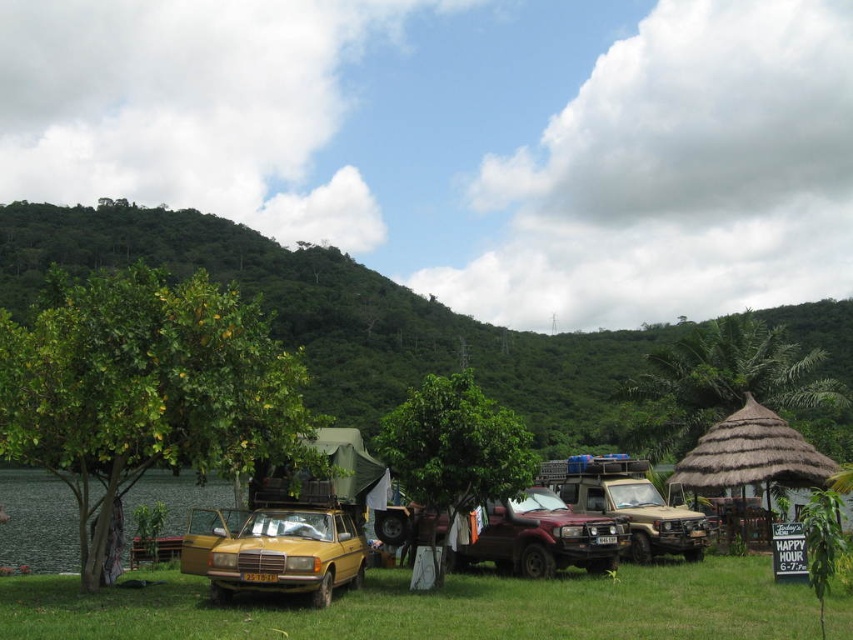
You are standing at the green grassy field at lower center and want to take a photo of the green leafy hillside at upper center. In which direction should you point your camera?

You should point your camera to the upper right direction because the green leafy hillside at upper center is located to the right of the green grassy field at lower center.

You are standing at the center of the image and want to walk to the green grassy field at lower center. Which direction should you move?

Since the green grassy field at lower center is located at point (433, 608), you should move downward from your current position at the center to reach it.